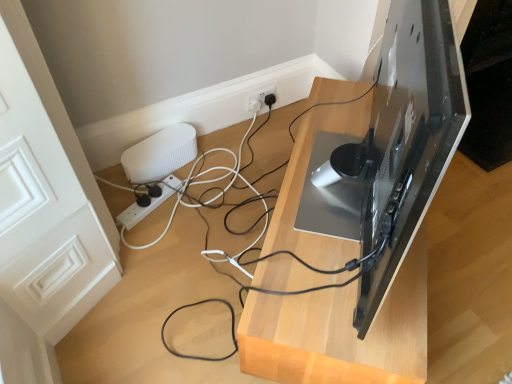
This screenshot has width=512, height=384. Find the location of `free space between black glossy tv stand at upper right and white plastic power strip at lower center`. free space between black glossy tv stand at upper right and white plastic power strip at lower center is located at coordinates (210, 233).